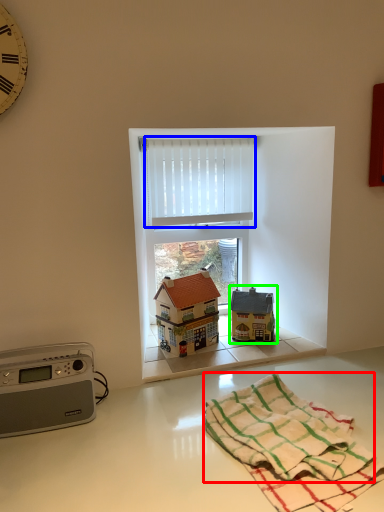
Question: Which is nearer to the bath towel (highlighted by a red box)? curtain (highlighted by a blue box) or toy (highlighted by a green box).

Choices:
 (A) curtain
 (B) toy

Answer: (B)